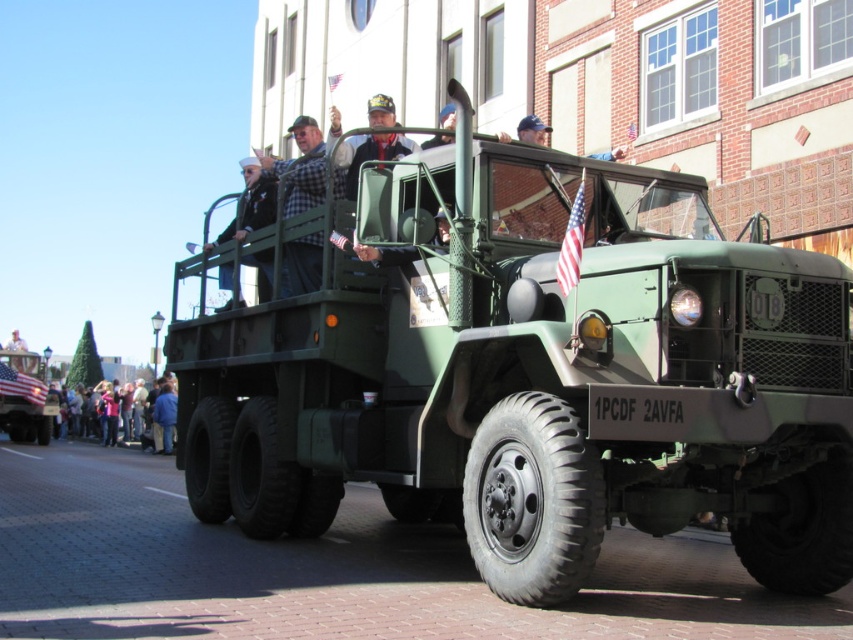
Question: Based on their relative distances, which object is nearer to the blue denim jacket at lower left?

Choices:
 (A) matte green truck at center
 (B) dark blue uniform at center

Answer: (B)

Question: From the image, what is the correct spatial relationship of matte black jeep at lower left in relation to blue denim jacket at lower left?

Choices:
 (A) right
 (B) left

Answer: (B)

Question: Can you confirm if matte green truck at center is positioned to the left of checkered fabric shirt at center?

Choices:
 (A) no
 (B) yes

Answer: (A)

Question: Which object is positioned closest to the matte green truck at center?

Choices:
 (A) checkered fabric shirt at center
 (B) dark blue uniform at center
 (C) matte black jeep at lower left
 (D) blue denim jacket at lower left

Answer: (A)

Question: Which object is farther from the camera taking this photo?

Choices:
 (A) dark blue uniform at center
 (B) checkered fabric shirt at center

Answer: (B)

Question: Can you confirm if checkered fabric shirt at center is bigger than matte black jeep at lower left?

Choices:
 (A) no
 (B) yes

Answer: (A)